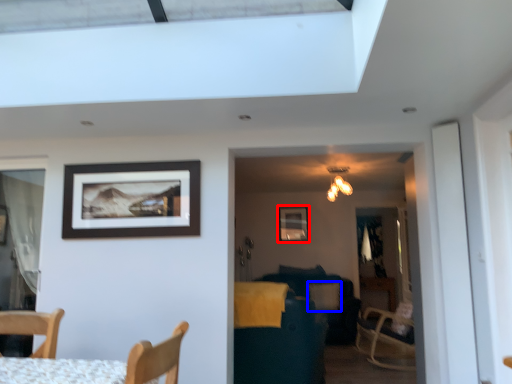
Question: Which point is closer to the camera, picture frame (highlighted by a red box) or pillow (highlighted by a blue box)?

Choices:
 (A) picture frame
 (B) pillow

Answer: (B)